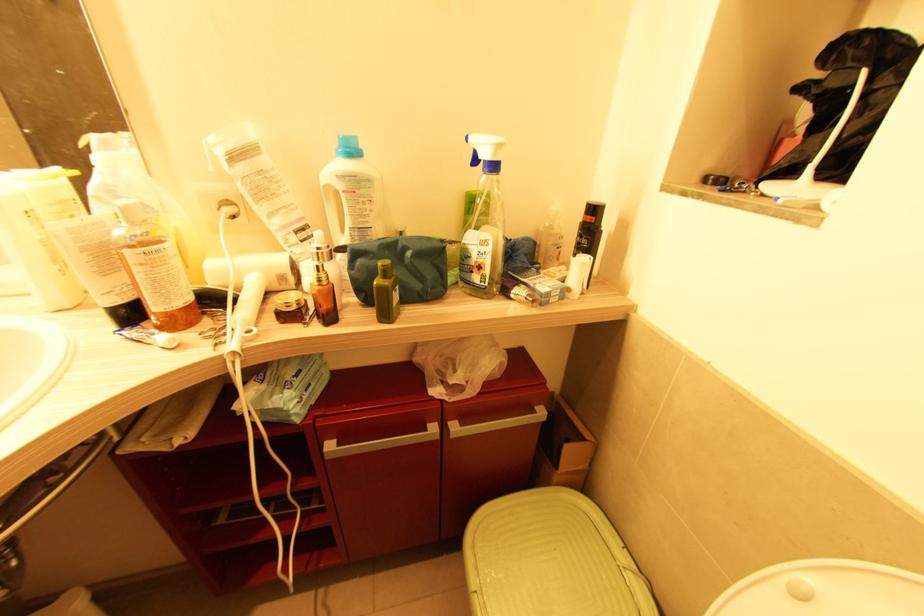
What are the coordinates of `green toiletry bag` in the screenshot? It's located at (399, 267).